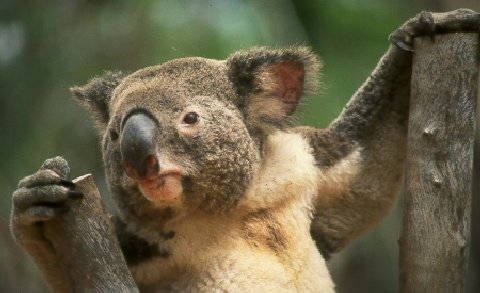
The width and height of the screenshot is (480, 293). In order to click on white chest in this screenshot , I will do `click(262, 273)`.